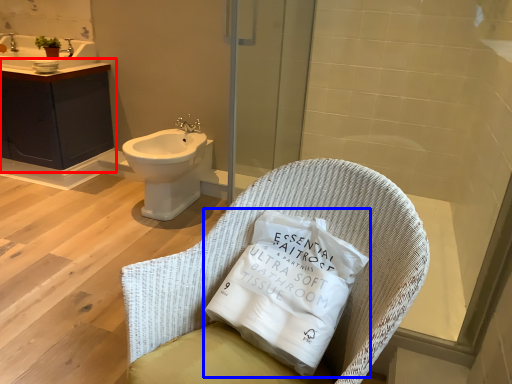
Question: Which object is further to the camera taking this photo, bathroom cabinet (highlighted by a red box) or pillow (highlighted by a blue box)?

Choices:
 (A) bathroom cabinet
 (B) pillow

Answer: (A)